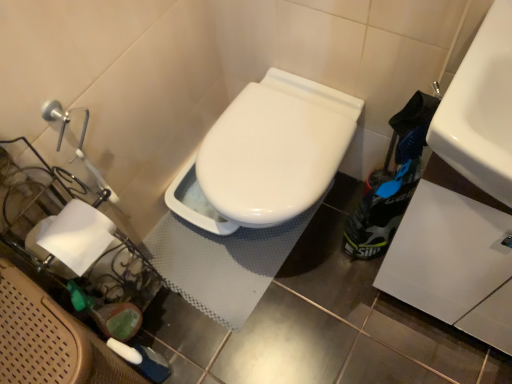
Find the location of a particular element. This screenshot has height=384, width=512. free space in front of white textured bath mat at center is located at coordinates (294, 332).